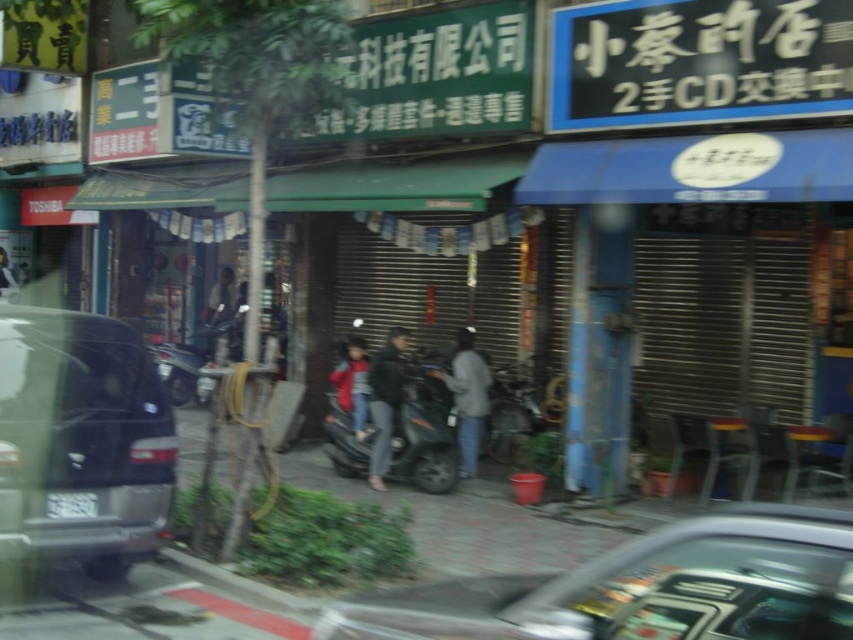
Is point (624, 609) closer to viewer compared to point (457, 380)?

Yes, it is.

Does metallic silver car at center have a greater height compared to gray fabric jacket at center?

No, metallic silver car at center is not taller than gray fabric jacket at center.

The height and width of the screenshot is (640, 853). In order to click on metallic silver car at center in this screenshot , I will do `click(642, 588)`.

Who is positioned more to the right, gray fabric jacket at center or black plastic license plate at center?

From the viewer's perspective, gray fabric jacket at center appears more on the right side.

Is gray fabric jacket at center shorter than black plastic license plate at center?

No, gray fabric jacket at center is not shorter than black plastic license plate at center.

Describe the element at coordinates (467, 397) in the screenshot. I see `gray fabric jacket at center` at that location.

At what (x,y) coordinates should I click in order to perform the action: click on gray fabric jacket at center. Please return your answer as a coordinate pair (x, y). This screenshot has width=853, height=640. Looking at the image, I should click on (467, 397).

Does metallic silver car at center appear on the left side of dark gray jacket at center?

No, metallic silver car at center is not to the left of dark gray jacket at center.

Does metallic silver car at center have a greater height compared to dark gray jacket at center?

Incorrect, metallic silver car at center's height is not larger of dark gray jacket at center's.

Identify the location of metallic silver car at center. The height and width of the screenshot is (640, 853). (642, 588).